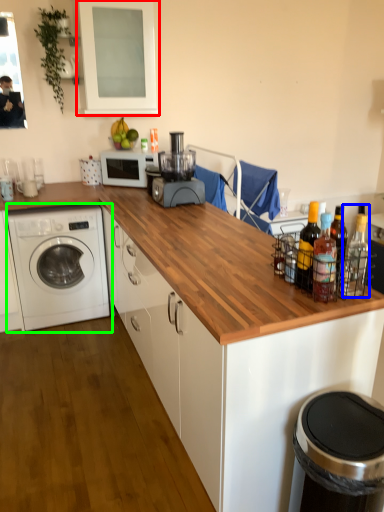
Question: Which object is positioned closest to window screen (highlighted by a red box)? Select from bottle (highlighted by a blue box) and washing machine (highlighted by a green box).

Choices:
 (A) bottle
 (B) washing machine

Answer: (B)